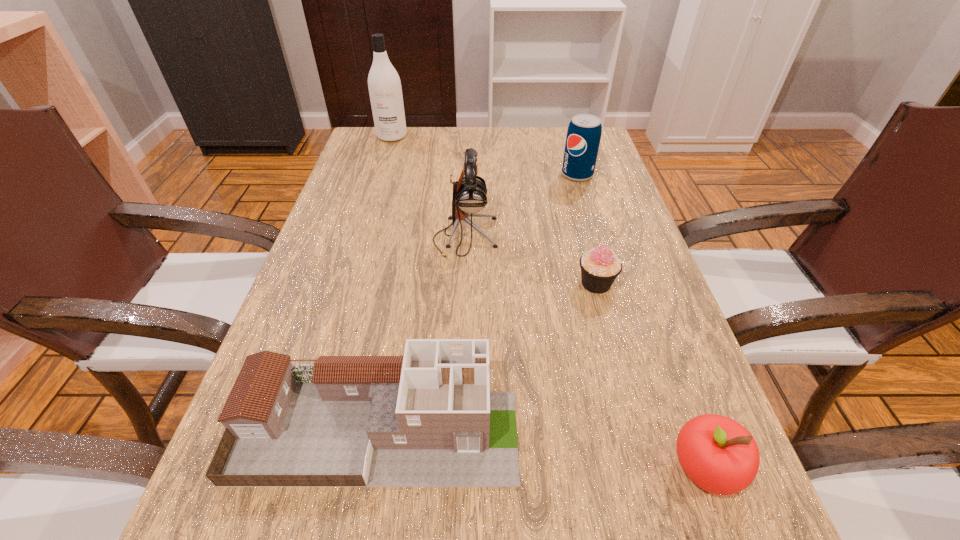
This screenshot has height=540, width=960. Find the location of `shampoo`. shampoo is located at coordinates (384, 84).

The width and height of the screenshot is (960, 540). What are the coordinates of `the tallest object` in the screenshot? It's located at (384, 84).

Where is `earphone`? earphone is located at coordinates (469, 195).

Find the location of a particular element. This screenshot has height=540, width=960. the third farthest object is located at coordinates (469, 195).

This screenshot has width=960, height=540. Find the location of `pop`. pop is located at coordinates (583, 137).

Identify the location of dollhouse. The image size is (960, 540). (426, 419).

In order to click on apple in this screenshot , I will do point(718,454).

I want to click on the fourth farthest object, so click(x=599, y=267).

Find the location of a particular element. the shortest object is located at coordinates (599, 267).

Where is `blank space located 0.340m on the front-facing side of the tallest object`? blank space located 0.340m on the front-facing side of the tallest object is located at coordinates (370, 210).